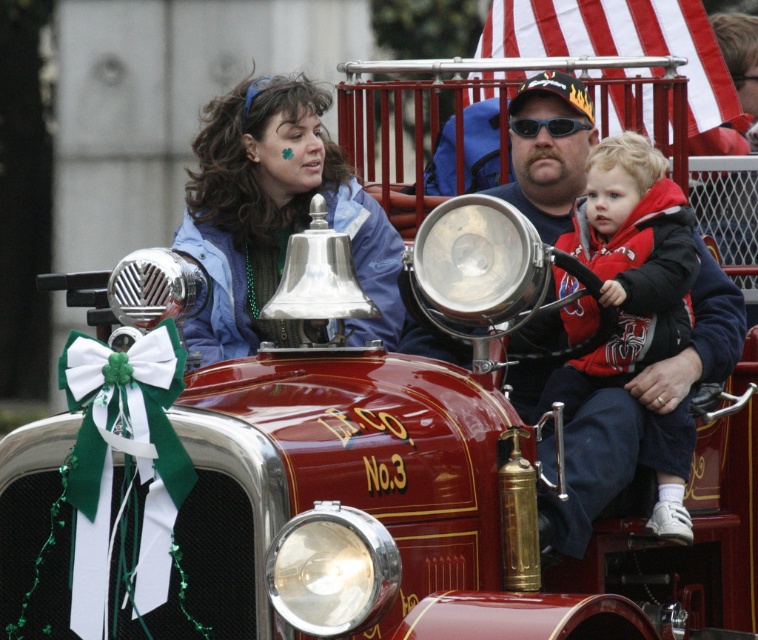
Question: Which point appears closest to the camera in this image?

Choices:
 (A) (230, 205)
 (B) (650, 179)

Answer: (B)

Question: From the image, what is the correct spatial relationship of blue fleece jacket at center in relation to red fleece jacket at center?

Choices:
 (A) below
 (B) above

Answer: (B)

Question: Can you confirm if blue fleece jacket at center is bigger than red fleece jacket at center?

Choices:
 (A) yes
 (B) no

Answer: (A)

Question: Is blue fleece jacket at center positioned behind red fleece jacket at center?

Choices:
 (A) no
 (B) yes

Answer: (A)

Question: Which of the following is the farthest from the observer?

Choices:
 (A) red fleece jacket at center
 (B) blue fleece jacket at center

Answer: (A)

Question: Which point is farther to the camera?

Choices:
 (A) (318, 115)
 (B) (672, 272)

Answer: (A)